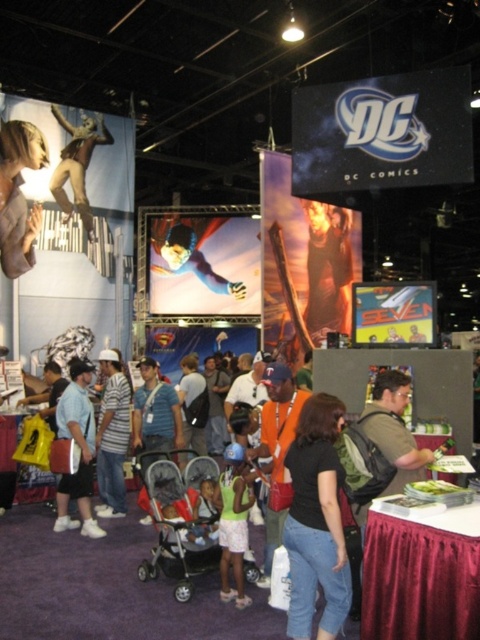
Question: Which of the following is the closest to the observer?

Choices:
 (A) silver metallic stroller at center
 (B) metallic silver statue at upper left
 (C) black matte shirt at center

Answer: (C)

Question: Does black matte shirt at center appear under blue fabric superman at center?

Choices:
 (A) yes
 (B) no

Answer: (A)

Question: Is the position of silver metallic stroller at center less distant than that of striped shirt at center?

Choices:
 (A) no
 (B) yes

Answer: (B)

Question: Which of the following is the farthest from the observer?

Choices:
 (A) tap(245, 561)
 (B) tap(26, 205)

Answer: (B)

Question: Where is black matte shirt at center located in relation to matte blue shirt at center in the image?

Choices:
 (A) left
 (B) right

Answer: (B)

Question: Based on their relative distances, which object is nearer to the striped shirt at center?

Choices:
 (A) matte blue shirt at center
 (B) black matte shirt at center
 (C) silver metallic stroller at center

Answer: (A)